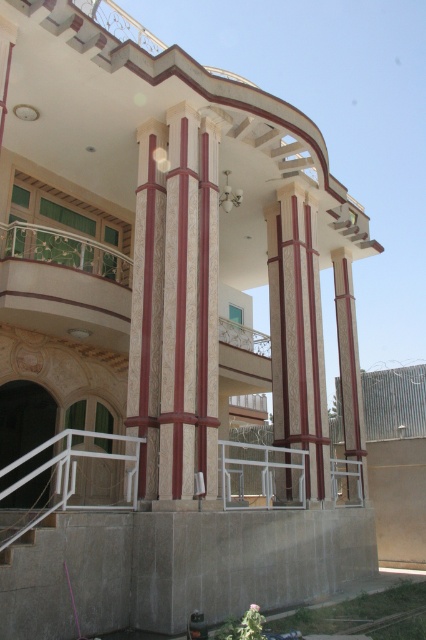
Question: Among these objects, which one is nearest to the camera?

Choices:
 (A) white concrete stairs at lower left
 (B) marble column at center

Answer: (A)

Question: Which of these objects is positioned farthest from the marble column at center?

Choices:
 (A) maroon textured column at center
 (B) smooth red wood pillar at center
 (C) marble column at right

Answer: (C)

Question: Is maroon textured column at center above white concrete stairs at lower left?

Choices:
 (A) yes
 (B) no

Answer: (A)

Question: Can you confirm if maroon textured column at center is wider than marble column at right?

Choices:
 (A) no
 (B) yes

Answer: (A)

Question: Among these points, which one is nearest to the camera?

Choices:
 (A) (181, 131)
 (B) (337, 273)
 (C) (207, 408)
 (D) (143, 417)

Answer: (D)

Question: Does marble column at center have a smaller size compared to white concrete stairs at lower left?

Choices:
 (A) yes
 (B) no

Answer: (B)